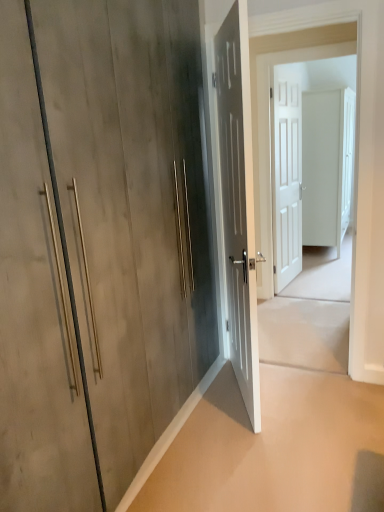
This screenshot has height=512, width=384. Identify the location of vacant point to the right of matte gray door at center, positioned as the 3th door in back-to-front order. (302, 395).